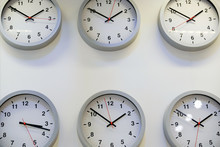
Where is `wall`? This screenshot has height=147, width=220. wall is located at coordinates (149, 77).